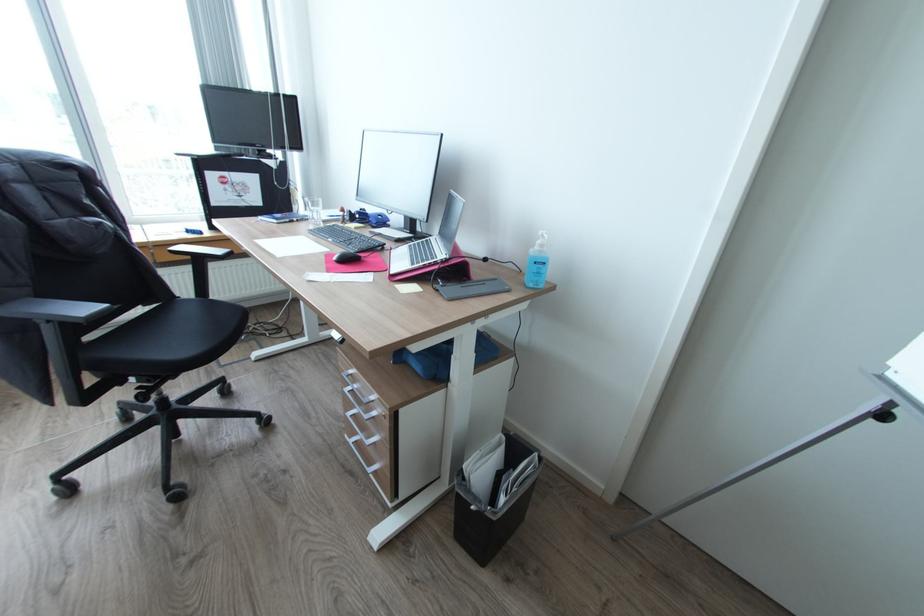
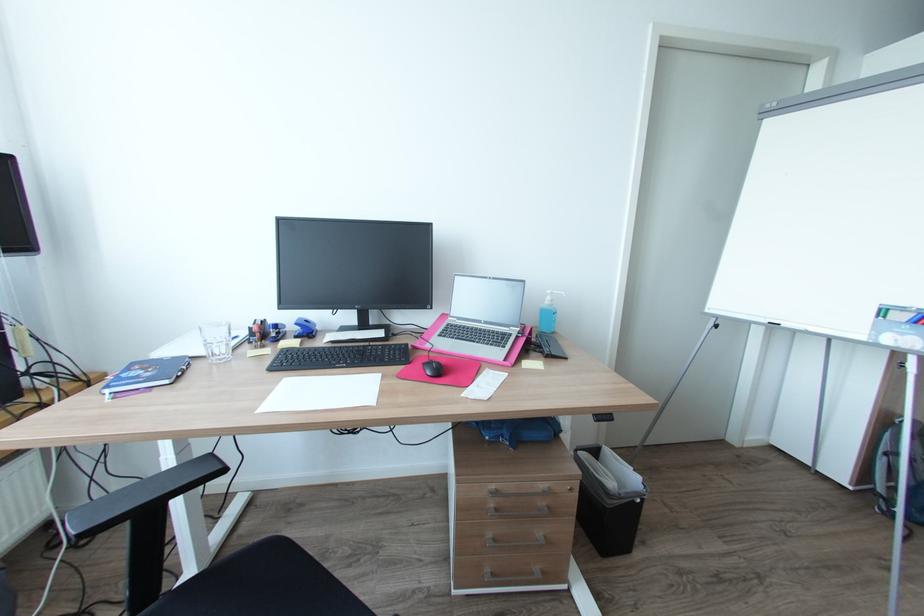
Locate, in the second image, the point that corresponds to the point at 357,371 in the first image.

(497, 487)